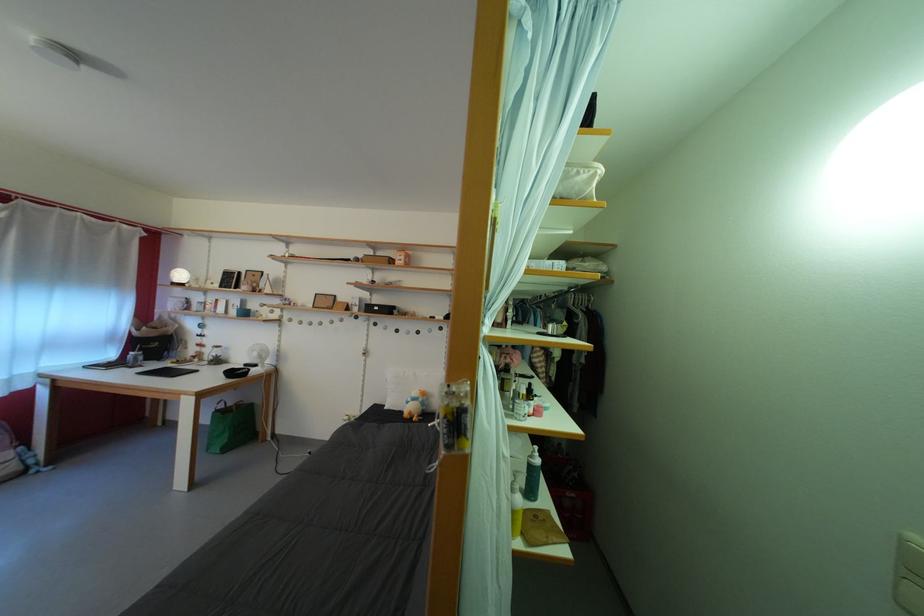
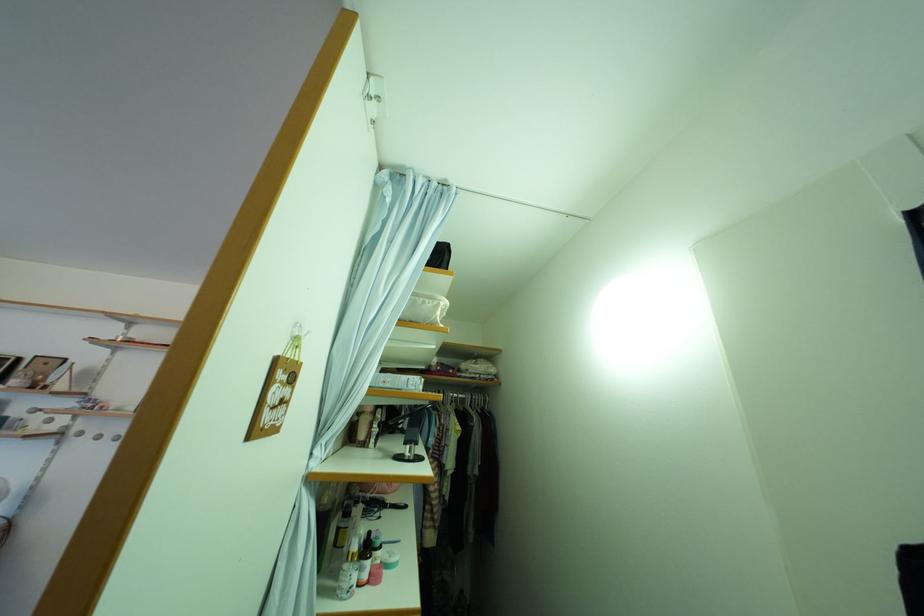
Locate, in the second image, the point that corresponds to point 544,402 in the first image.

(390, 554)